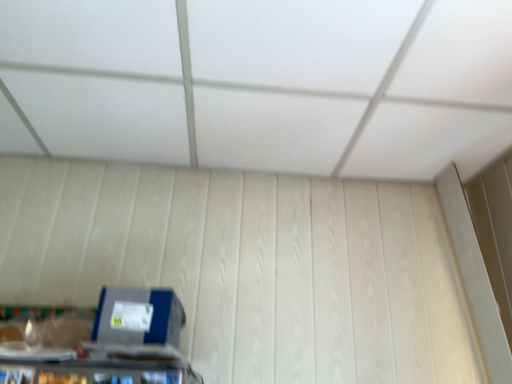
Question: Should I look upward or downward to see white matte exhaust hood at upper center?

Choices:
 (A) down
 (B) up

Answer: (B)

Question: Considering the relative sizes of white matte exhaust hood at upper center and blue cardboard box at lower left in the image provided, is white matte exhaust hood at upper center thinner than blue cardboard box at lower left?

Choices:
 (A) no
 (B) yes

Answer: (A)

Question: Considering the relative sizes of white matte exhaust hood at upper center and blue cardboard box at lower left in the image provided, is white matte exhaust hood at upper center smaller than blue cardboard box at lower left?

Choices:
 (A) no
 (B) yes

Answer: (A)

Question: Can you confirm if white matte exhaust hood at upper center is shorter than blue cardboard box at lower left?

Choices:
 (A) yes
 (B) no

Answer: (A)

Question: Is white matte exhaust hood at upper center oriented towards blue cardboard box at lower left?

Choices:
 (A) yes
 (B) no

Answer: (B)

Question: Is white matte exhaust hood at upper center positioned far away from blue cardboard box at lower left?

Choices:
 (A) yes
 (B) no

Answer: (B)

Question: Is the depth of white matte exhaust hood at upper center greater than that of blue cardboard box at lower left?

Choices:
 (A) no
 (B) yes

Answer: (A)

Question: Is blue cardboard box at lower left directly adjacent to white matte exhaust hood at upper center?

Choices:
 (A) yes
 (B) no

Answer: (B)

Question: Is blue cardboard box at lower left oriented towards white matte exhaust hood at upper center?

Choices:
 (A) no
 (B) yes

Answer: (A)

Question: Is blue cardboard box at lower left outside white matte exhaust hood at upper center?

Choices:
 (A) no
 (B) yes

Answer: (B)

Question: Does blue cardboard box at lower left lie in front of white matte exhaust hood at upper center?

Choices:
 (A) no
 (B) yes

Answer: (A)

Question: Considering the relative sizes of blue cardboard box at lower left and white matte exhaust hood at upper center in the image provided, is blue cardboard box at lower left bigger than white matte exhaust hood at upper center?

Choices:
 (A) no
 (B) yes

Answer: (A)

Question: From a real-world perspective, is blue cardboard box at lower left over white matte exhaust hood at upper center?

Choices:
 (A) yes
 (B) no

Answer: (B)

Question: Based on their positions, is white matte exhaust hood at upper center located to the left or right of blue cardboard box at lower left?

Choices:
 (A) right
 (B) left

Answer: (A)